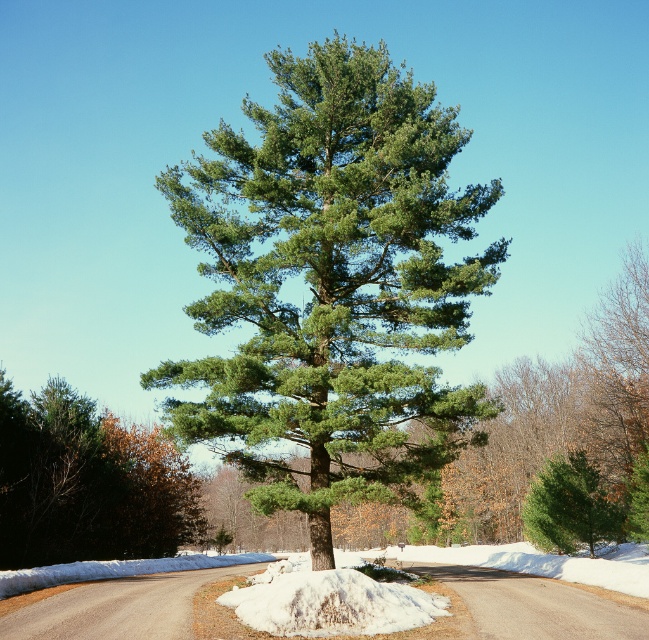
Question: Which object appears farthest from the camera in this image?

Choices:
 (A) green matte evergreen tree at center
 (B) green matte tree at center
 (C) green needle-like at center

Answer: (B)

Question: Which point is closer to the camera taking this photo?

Choices:
 (A) (299, 490)
 (B) (36, 550)
 (C) (550, 493)

Answer: (A)

Question: Can you confirm if green matte tree at center is bigger than green matte evergreen tree at center?

Choices:
 (A) yes
 (B) no

Answer: (A)

Question: Does green needle-like at center have a lesser width compared to green matte evergreen tree at center?

Choices:
 (A) no
 (B) yes

Answer: (A)

Question: Which point appears closest to the camera in this image?

Choices:
 (A) (284, 241)
 (B) (101, 470)
 (C) (607, 516)

Answer: (A)

Question: Is green needle-like at center thinner than green matte tree at center?

Choices:
 (A) yes
 (B) no

Answer: (B)